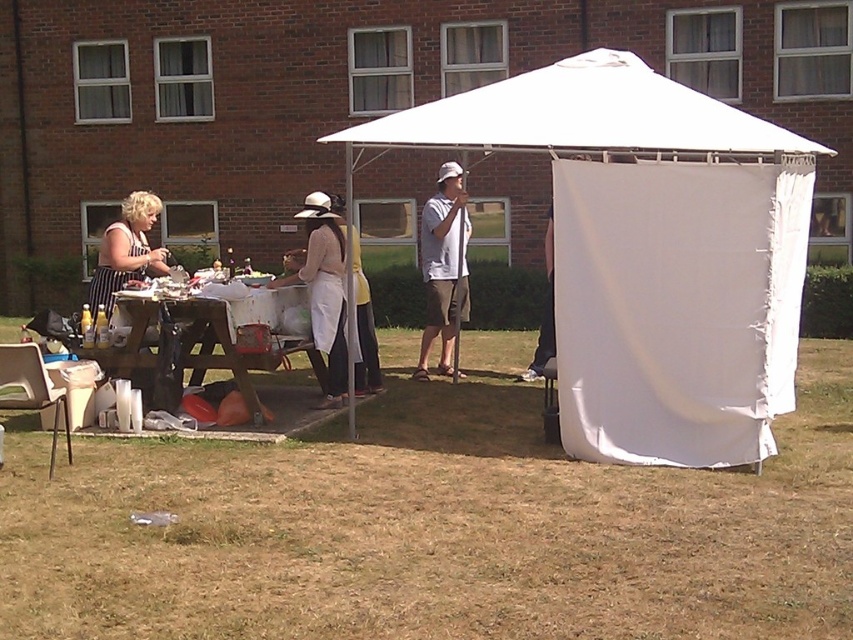
You are organizing an outdoor event and need to decide whether to place a large banner under the white fabric tent at center or on the white cotton shirt at center. Based on their sizes, which location would be more appropriate for the banner?

The white fabric tent at center is larger in size than the white cotton shirt at center, so the banner should be placed under the white fabric tent at center as it can accommodate the larger size.